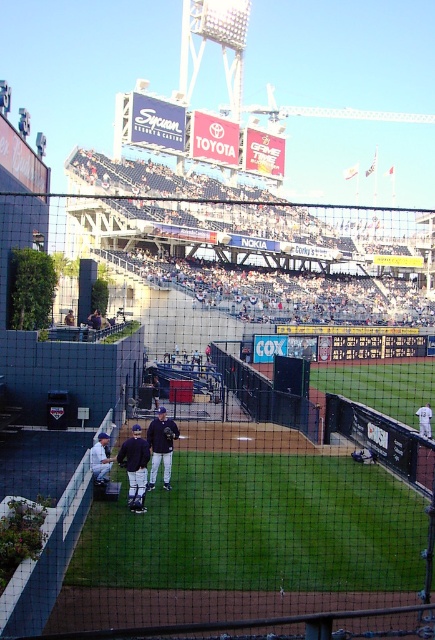
You are a photographer at the baseball stadium wanting to capture a photo of the white uniformed players at center and the black leather baseball glove at center. Which object is located to the left of the other?

The black leather baseball glove at center is positioned to the left of the white uniformed players at center.

You are a photographer positioned at the center of the baseball field. You want to take a photo of the dark blue uniform at center. Which direction should you point your camera to capture it?

The dark blue uniform at center is located at point 0.731 on the x axis and 0.310 on the y axis. Since you are at the center of the field, you should point your camera towards the northeast direction to capture the dark blue uniform at center.

You are a photographer positioned at the edge of the field near the dugout. You want to take a photo that includes both the white uniformed players at center and the light blue jersey at center. Given that your camera has a maximum focus range of 180 feet, will you be able to capture both subjects in focus simultaneously?

The white uniformed players at center is 185.43 feet from the light blue jersey at center. Since the distance between them exceeds the camera maximum focus range of 180 feet, you cannot capture both subjects in focus simultaneously.